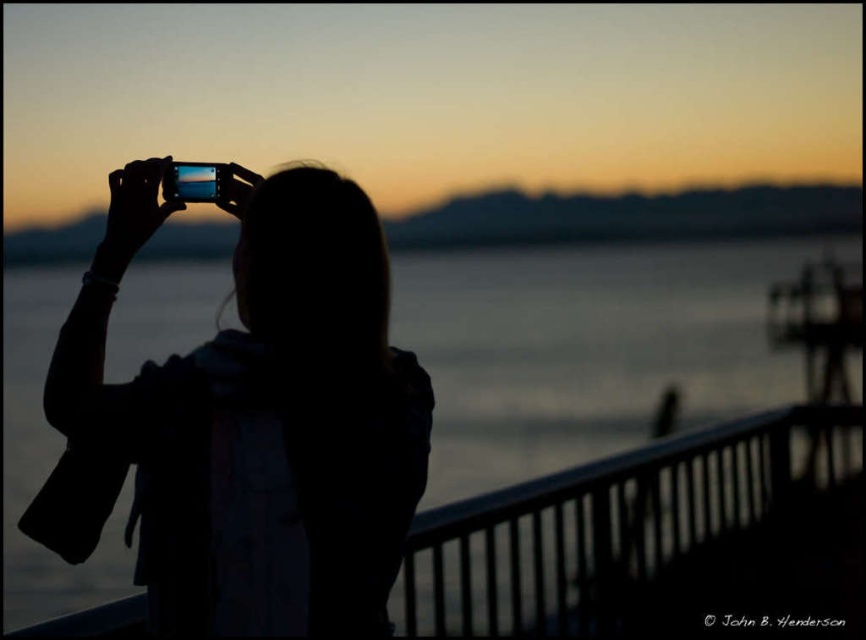
Question: Which point is farther to the camera?

Choices:
 (A) (755, 308)
 (B) (388, 428)

Answer: (A)

Question: Is silhouette hair at center above transparent water at center?

Choices:
 (A) no
 (B) yes

Answer: (B)

Question: Which object appears closest to the camera in this image?

Choices:
 (A) silhouette hair at center
 (B) transparent water at center

Answer: (A)

Question: Is silhouette hair at center to the left of transparent water at center from the viewer's perspective?

Choices:
 (A) yes
 (B) no

Answer: (B)

Question: Is silhouette hair at center above transparent water at center?

Choices:
 (A) no
 (B) yes

Answer: (B)

Question: Among these points, which one is farthest from the camera?

Choices:
 (A) (x=399, y=326)
 (B) (x=309, y=557)

Answer: (A)